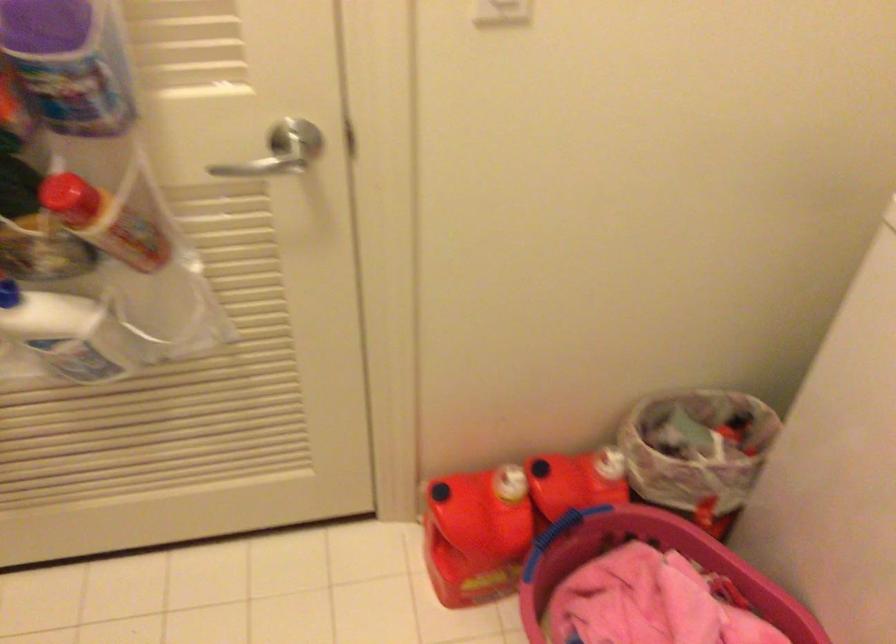
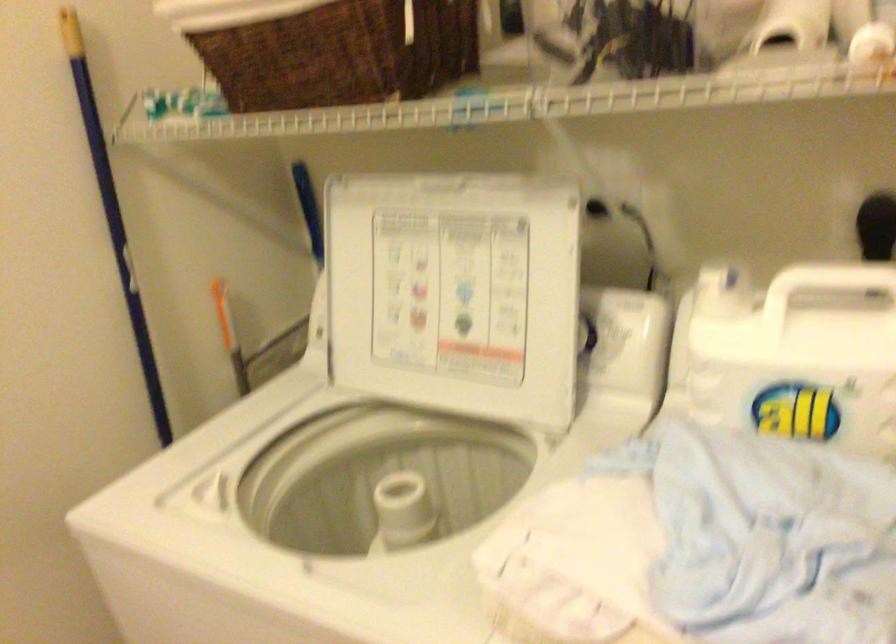
Question: How did the camera likely rotate?

Choices:
 (A) Left
 (B) Right
 (C) Up
 (D) Down

Answer: (B)